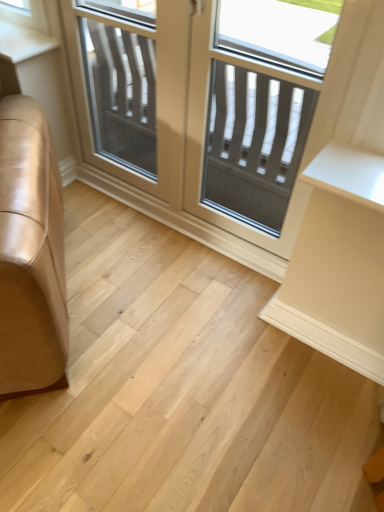
Question: Which direction should I rotate to look at clear glass screen door at center, placed as the second screen door when sorted from right to left?

Choices:
 (A) right
 (B) left

Answer: (B)

Question: Is clear glass screen door at center, placed as the second screen door when sorted from right to left, completely or partially outside of clear glass door at center?

Choices:
 (A) no
 (B) yes

Answer: (A)

Question: From the image's perspective, does clear glass screen door at center, placed as the second screen door when sorted from right to left, appear higher than clear glass door at center?

Choices:
 (A) yes
 (B) no

Answer: (A)

Question: From the image's perspective, is clear glass screen door at center, placed as the second screen door when sorted from right to left, under clear glass door at center?

Choices:
 (A) no
 (B) yes

Answer: (A)

Question: Is clear glass screen door at center, which ranks as the 1th screen door in left-to-right order, closer to camera compared to clear glass door at center?

Choices:
 (A) yes
 (B) no

Answer: (B)

Question: Can you confirm if clear glass screen door at center, placed as the second screen door when sorted from right to left, is taller than clear glass door at center?

Choices:
 (A) no
 (B) yes

Answer: (A)

Question: Can you confirm if clear glass screen door at center, placed as the second screen door when sorted from right to left, is positioned to the right of clear glass door at center?

Choices:
 (A) no
 (B) yes

Answer: (A)

Question: From a real-world perspective, is matte gray screen door at center, arranged as the first screen door when viewed from the right, positioned under clear glass screen door at center, which ranks as the 1th screen door in left-to-right order, based on gravity?

Choices:
 (A) yes
 (B) no

Answer: (B)

Question: Can you confirm if matte gray screen door at center, arranged as the first screen door when viewed from the right, is shorter than clear glass screen door at center, placed as the second screen door when sorted from right to left?

Choices:
 (A) yes
 (B) no

Answer: (B)

Question: Does matte gray screen door at center, arranged as the first screen door when viewed from the right, have a larger size compared to clear glass screen door at center, which ranks as the 1th screen door in left-to-right order?

Choices:
 (A) no
 (B) yes

Answer: (B)

Question: Is matte gray screen door at center, arranged as the first screen door when viewed from the right, aimed at clear glass screen door at center, placed as the second screen door when sorted from right to left?

Choices:
 (A) no
 (B) yes

Answer: (A)

Question: From a real-world perspective, is matte gray screen door at center, arranged as the first screen door when viewed from the right, physically above clear glass screen door at center, which ranks as the 1th screen door in left-to-right order?

Choices:
 (A) no
 (B) yes

Answer: (B)

Question: From the image's perspective, is matte gray screen door at center, arranged as the first screen door when viewed from the right, on top of clear glass screen door at center, placed as the second screen door when sorted from right to left?

Choices:
 (A) yes
 (B) no

Answer: (B)

Question: Is clear glass door at center facing towards matte gray screen door at center, which is the second screen door in left-to-right order?

Choices:
 (A) no
 (B) yes

Answer: (B)